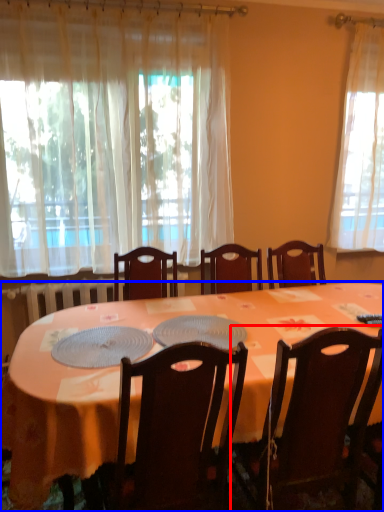
Question: Among these objects, which one is nearest to the camera, chair (highlighted by a red box) or desk (highlighted by a blue box)?

Choices:
 (A) chair
 (B) desk

Answer: (B)